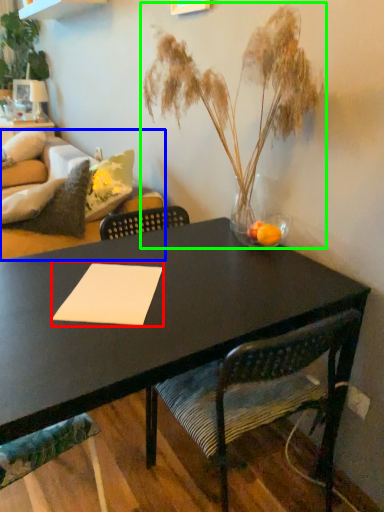
Question: Which object is the farthest from notepad (highlighted by a red box)? Choose among these: couch (highlighted by a blue box) or houseplant (highlighted by a green box).

Choices:
 (A) couch
 (B) houseplant

Answer: (A)